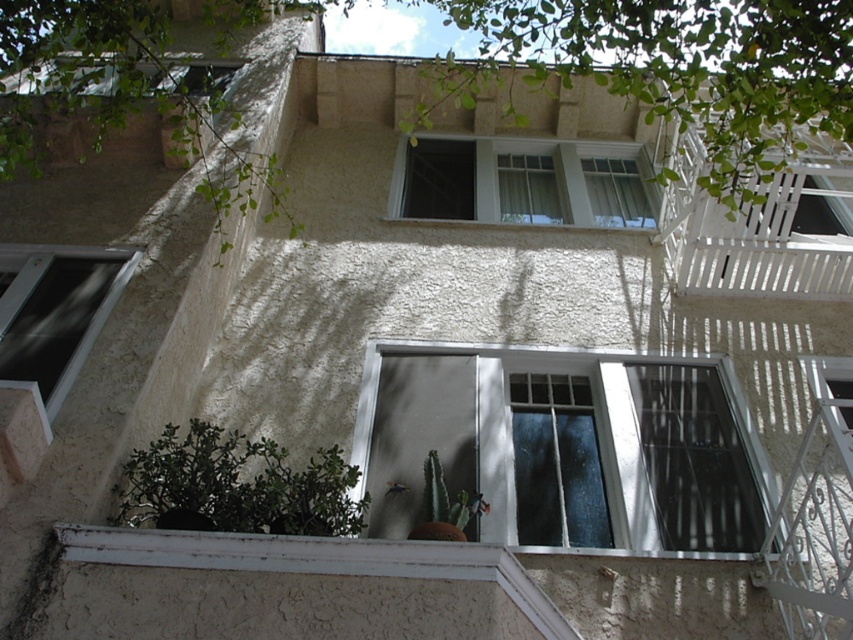
You are a window cleaner standing on the balcony ledge. You need to reach both the green leafy tree at upper left and the white painted wood at lower center. Which object will require you to climb higher to reach?

The green leafy tree at upper left requires climbing higher because it is larger in size compared to the white painted wood at lower center, which is smaller and closer to the ground.

You are standing in front of the building and want to place a new potted plant on the white painted wood at lower center. Can you see the green leafy tree at upper left from that position?

Yes, because the green leafy tree at upper left is above the white painted wood at lower center, so when placing the plant on the white painted wood at lower center, you would be able to see the green leafy tree at upper left above it.